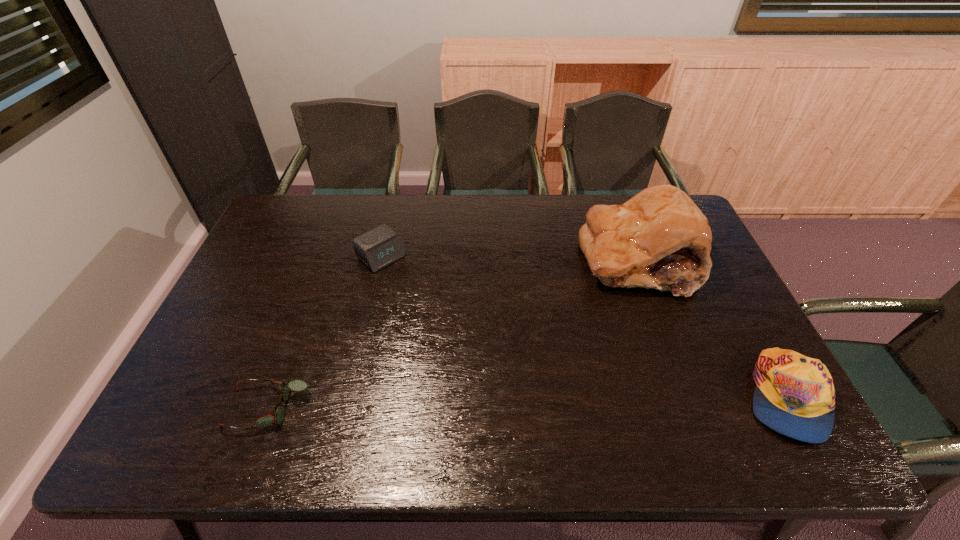
Locate an element on the screen. Image resolution: width=960 pixels, height=540 pixels. the shortest object is located at coordinates (297, 385).

I want to click on spectacles, so click(297, 385).

Locate an element on the screen. cap is located at coordinates (794, 395).

Locate an element on the screen. This screenshot has height=540, width=960. the tallest object is located at coordinates (659, 239).

The width and height of the screenshot is (960, 540). I want to click on the second shortest object, so click(x=378, y=248).

Where is `alarm clock`? This screenshot has height=540, width=960. alarm clock is located at coordinates (378, 248).

Find the location of a particular element. The image size is (960, 540). free space located on the front-facing side of the shortest object is located at coordinates (203, 408).

You are a GUI agent. You are given a task and a screenshot of the screen. Output one action in this format:
    pyautogui.click(x=<x>, y=<y>)
    Task: Click on the vacant area situated 0.250m on the filling side of the tallest object
    The width and height of the screenshot is (960, 540).
    Given the screenshot: What is the action you would take?
    pyautogui.click(x=573, y=350)

At what (x,y) coordinates should I click in order to perform the action: click on free space located 0.310m on the filling side of the tallest object. Please return your answer as a coordinate pair (x, y). Looking at the image, I should click on (563, 366).

Find the location of a particular element. The width and height of the screenshot is (960, 540). free space located on the filling side of the tallest object is located at coordinates (600, 312).